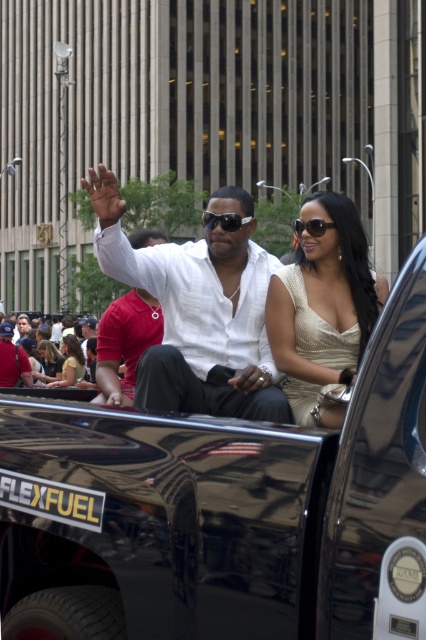
Between white glossy shirt at center and matte black dress at center, which one has more height?

With more height is matte black dress at center.

Is point (247, 198) less distant than point (37, 348)?

Yes, point (247, 198) is closer to viewer.

Locate an element on the screen. This screenshot has width=426, height=640. white glossy shirt at center is located at coordinates (198, 310).

Can you confirm if white cotton shirt at center is wider than light yellow fabric shirt at center?

Yes.

Between white cotton shirt at center and light yellow fabric shirt at center, which one appears on the left side from the viewer's perspective?

light yellow fabric shirt at center

Between point (118, 392) and point (66, 355), which one is positioned behind?

Positioned behind is point (66, 355).

I want to click on white cotton shirt at center, so click(124, 342).

Locate an element on the screen. This screenshot has width=426, height=640. white glossy shirt at center is located at coordinates (198, 310).

Does white glossy shirt at center have a larger size compared to light yellow fabric shirt at center?

No, white glossy shirt at center is not bigger than light yellow fabric shirt at center.

Is point (140, 362) farther from viewer compared to point (65, 376)?

No, (140, 362) is closer to viewer.

This screenshot has height=640, width=426. Find the location of `white glossy shirt at center`. white glossy shirt at center is located at coordinates (198, 310).